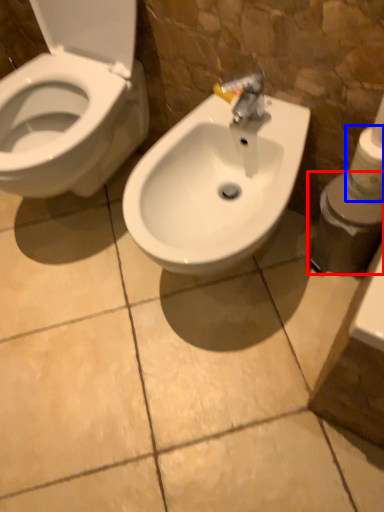
Question: Which of the following is the farthest to the observer, toiletries (highlighted by a red box) or toilet paper (highlighted by a blue box)?

Choices:
 (A) toiletries
 (B) toilet paper

Answer: (A)